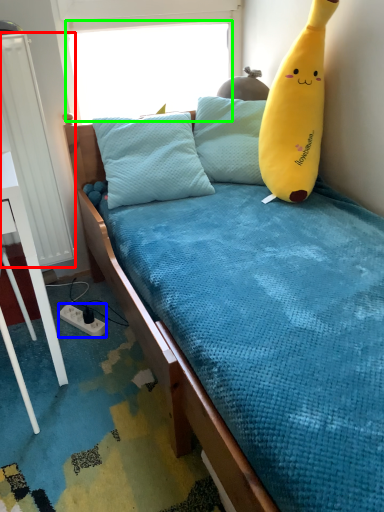
Question: Based on their relative distances, which object is nearer to radiator (highlighted by a red box)? Choose from power outlet (highlighted by a blue box) and window screen (highlighted by a green box).

Choices:
 (A) power outlet
 (B) window screen

Answer: (A)